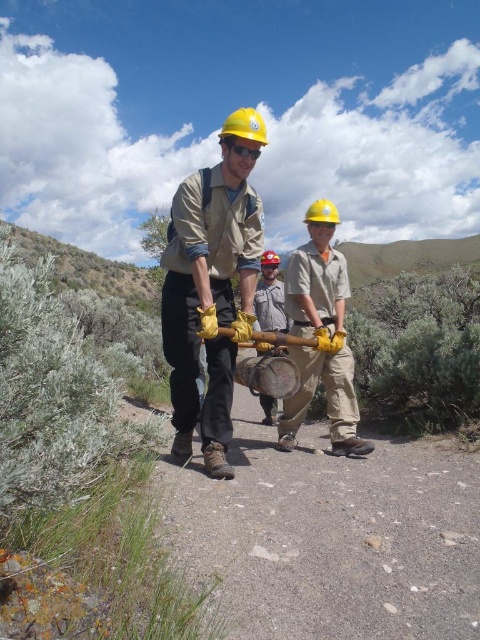
Does matte yellow hard hat at center have a lesser width compared to brushed metal bucket at center?

Incorrect, matte yellow hard hat at center's width is not less than brushed metal bucket at center's.

From the picture: Can you confirm if matte yellow hard hat at center is wider than brushed metal bucket at center?

Yes, matte yellow hard hat at center is wider than brushed metal bucket at center.

The width and height of the screenshot is (480, 640). I want to click on matte yellow hard hat at center, so click(211, 285).

Find the location of `matte yellow hard hat at center`. matte yellow hard hat at center is located at coordinates (211, 285).